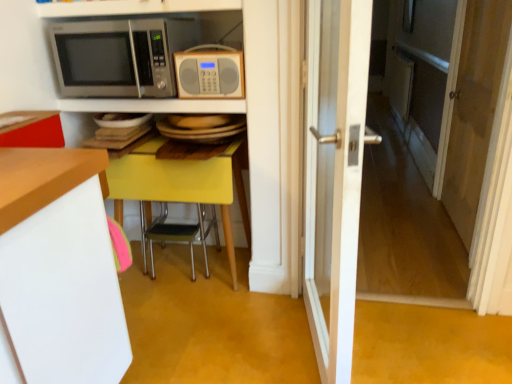
How much space does metallic silver microwave at upper center, positioned as the 1th shelf in bottom-to-top order, occupy vertically?

2.18 inches.

What do you see at coordinates (474, 109) in the screenshot? I see `transparent glass door at right` at bounding box center [474, 109].

Locate an element on the screen. The image size is (512, 384). satin silver microwave at upper left, which ranks as the second microwave oven in right-to-left order is located at coordinates (120, 56).

How much space does white glossy shelf at upper center, acting as the 2th shelf starting from the bottom, occupy vertically?

2.13 inches.

Identify the location of matte gray radio at center, placed as the second microwave oven when sorted from left to right. (210, 72).

Measure the distance between point (223,199) and camera.

Point (223,199) and camera are 1.93 meters apart.

At what (x,y) coordinates should I click in order to perform the action: click on metallic silver microwave at upper center, positioned as the 1th shelf in bottom-to-top order. Please return your answer as a coordinate pair (x, y). Image resolution: width=512 pixels, height=384 pixels. Looking at the image, I should click on (153, 105).

Based on the photo, are transparent glass door at right and matte gray radio at center, marked as the first microwave oven in a right-to-left arrangement, far apart?

transparent glass door at right is far away from matte gray radio at center, marked as the first microwave oven in a right-to-left arrangement.

The height and width of the screenshot is (384, 512). What are the coordinates of `the 1st microwave oven above the transparent glass door at right (from a real-world perspective)` in the screenshot? It's located at (x=210, y=72).

What's the angular difference between transparent glass door at right and matte gray radio at center, placed as the second microwave oven when sorted from left to right,'s facing directions?

The facing directions of transparent glass door at right and matte gray radio at center, placed as the second microwave oven when sorted from left to right, are 92.1 degrees apart.

From a real-world perspective, is transparent glass door at right positioned under matte gray radio at center, marked as the first microwave oven in a right-to-left arrangement, based on gravity?

Yes, from a real-world perspective, transparent glass door at right is under matte gray radio at center, marked as the first microwave oven in a right-to-left arrangement.

Considering the relative positions of satin silver microwave at upper left, which ranks as the second microwave oven in right-to-left order, and matte gray radio at center, placed as the second microwave oven when sorted from left to right, in the image provided, is satin silver microwave at upper left, which ranks as the second microwave oven in right-to-left order, to the left of matte gray radio at center, placed as the second microwave oven when sorted from left to right, from the viewer's perspective?

Correct, you'll find satin silver microwave at upper left, which ranks as the second microwave oven in right-to-left order, to the left of matte gray radio at center, placed as the second microwave oven when sorted from left to right.

Which of these two, satin silver microwave at upper left, the first microwave oven when ordered from left to right, or matte gray radio at center, marked as the first microwave oven in a right-to-left arrangement, stands taller?

satin silver microwave at upper left, the first microwave oven when ordered from left to right, is taller.

Where is `microwave oven that appears behind the satin silver microwave at upper left, which ranks as the second microwave oven in right-to-left order`? The width and height of the screenshot is (512, 384). microwave oven that appears behind the satin silver microwave at upper left, which ranks as the second microwave oven in right-to-left order is located at coordinates (210, 72).

How different are the orientations of satin silver microwave at upper left, which ranks as the second microwave oven in right-to-left order, and matte gray radio at center, marked as the first microwave oven in a right-to-left arrangement, in degrees?

1.87 degrees separate the facing orientations of satin silver microwave at upper left, which ranks as the second microwave oven in right-to-left order, and matte gray radio at center, marked as the first microwave oven in a right-to-left arrangement.

Consider the image. Which object is further away from the camera taking this photo, matte gray radio at center, marked as the first microwave oven in a right-to-left arrangement, or yellow glossy table at center?

yellow glossy table at center is behind.

Looking at the image, does matte gray radio at center, marked as the first microwave oven in a right-to-left arrangement, seem bigger or smaller compared to yellow glossy table at center?

In the image, matte gray radio at center, marked as the first microwave oven in a right-to-left arrangement, appears to be smaller than yellow glossy table at center.

Is matte gray radio at center, marked as the first microwave oven in a right-to-left arrangement, far from yellow glossy table at center?

They are positioned close to each other.

From a real-world perspective, which object stands above the other?

From a 3D spatial view, matte gray radio at center, marked as the first microwave oven in a right-to-left arrangement, is above.

Does matte gray radio at center, placed as the second microwave oven when sorted from left to right, come behind transparent glass door at right?

No, it is in front of transparent glass door at right.

Which point is more distant from viewer, (220, 55) or (458, 132)?

The point (458, 132) is behind.

What are the coordinates of `screen door behind the matte gray radio at center, marked as the first microwave oven in a right-to-left arrangement` in the screenshot? It's located at (474, 109).

Is matte gray radio at center, placed as the second microwave oven when sorted from left to right, oriented away from transparent glass door at right?

That's not correct — matte gray radio at center, placed as the second microwave oven when sorted from left to right, is not looking away from transparent glass door at right.

Is white wooden door at center in front of or behind metallic yellow chair at center in the image?

white wooden door at center is positioned closer to the viewer than metallic yellow chair at center.

Choose the correct answer: Is white wooden door at center inside metallic yellow chair at center or outside it?

The correct answer is: outside.

Consider the image. Considering the relative sizes of white wooden door at center and metallic yellow chair at center in the image provided, is white wooden door at center taller than metallic yellow chair at center?

Indeed, white wooden door at center has a greater height compared to metallic yellow chair at center.

Looking at their sizes, would you say yellow glossy table at center is wider or thinner than metallic silver microwave at upper center, which is the second shelf from top to bottom?

In the image, yellow glossy table at center appears to be wider than metallic silver microwave at upper center, which is the second shelf from top to bottom.

From a real-world perspective, is yellow glossy table at center below metallic silver microwave at upper center, which is the second shelf from top to bottom?

Yes, from a real-world perspective, yellow glossy table at center is beneath metallic silver microwave at upper center, which is the second shelf from top to bottom.

Would you consider yellow glossy table at center to be distant from metallic silver microwave at upper center, which is the second shelf from top to bottom?

No, yellow glossy table at center is not far from metallic silver microwave at upper center, which is the second shelf from top to bottom.

Is metallic silver microwave at upper center, which is the second shelf from top to bottom, far from matte gray radio at center, marked as the first microwave oven in a right-to-left arrangement?

No, metallic silver microwave at upper center, which is the second shelf from top to bottom, is not far away from matte gray radio at center, marked as the first microwave oven in a right-to-left arrangement.

Does metallic silver microwave at upper center, positioned as the 1th shelf in bottom-to-top order, have a lesser height compared to matte gray radio at center, marked as the first microwave oven in a right-to-left arrangement?

Yes.

Is metallic silver microwave at upper center, which is the second shelf from top to bottom, inside or outside of matte gray radio at center, placed as the second microwave oven when sorted from left to right?

The correct answer is: outside.

Starting from the matte gray radio at center, placed as the second microwave oven when sorted from left to right, which shelf is the 2nd one to the left? Please provide its 2D coordinates.

[(153, 105)]

Where is `screen door on the right of matte gray radio at center, placed as the second microwave oven when sorted from left to right`? This screenshot has height=384, width=512. screen door on the right of matte gray radio at center, placed as the second microwave oven when sorted from left to right is located at coordinates (474, 109).

The width and height of the screenshot is (512, 384). Identify the location of microwave oven located behind the satin silver microwave at upper left, the first microwave oven when ordered from left to right. (210, 72).

From the image, which object appears to be nearer to white glossy shelf at upper center, acting as the 2th shelf starting from the bottom, white wooden door at center or yellow glossy table at center?

yellow glossy table at center is closer to white glossy shelf at upper center, acting as the 2th shelf starting from the bottom.

From the picture: Which object lies further to the anchor point transparent glass door at right, white glossy shelf at upper center, which is the 1th shelf in top-to-bottom order, or matte gray radio at center, marked as the first microwave oven in a right-to-left arrangement?

The object further to transparent glass door at right is white glossy shelf at upper center, which is the 1th shelf in top-to-bottom order.

Which object lies further to the anchor point satin silver microwave at upper left, the first microwave oven when ordered from left to right, transparent glass door at right or matte gray radio at center, placed as the second microwave oven when sorted from left to right?

transparent glass door at right lies further to satin silver microwave at upper left, the first microwave oven when ordered from left to right, than the other object.

Looking at the image, which one is located further to matte gray radio at center, marked as the first microwave oven in a right-to-left arrangement, metallic silver microwave at upper center, which is the second shelf from top to bottom, or yellow glossy table at center?

Among the two, yellow glossy table at center is located further to matte gray radio at center, marked as the first microwave oven in a right-to-left arrangement.

Based on their spatial positions, is transparent glass door at right or yellow glossy table at center closer to white wooden door at center?

yellow glossy table at center.

Looking at the image, which one is located closer to yellow glossy table at center, metallic silver microwave at upper center, positioned as the 1th shelf in bottom-to-top order, or satin silver microwave at upper left, which ranks as the second microwave oven in right-to-left order?

metallic silver microwave at upper center, positioned as the 1th shelf in bottom-to-top order, lies closer to yellow glossy table at center than the other object.

Based on their spatial positions, is matte gray radio at center, placed as the second microwave oven when sorted from left to right, or metallic silver microwave at upper center, which is the second shelf from top to bottom, closer to transparent glass door at right?

matte gray radio at center, placed as the second microwave oven when sorted from left to right, is closer to transparent glass door at right.

Estimate the real-world distances between objects in this image. Which object is further from white wooden door at center, white glossy shelf at upper center, which is the 1th shelf in top-to-bottom order, or yellow glossy table at center?

white glossy shelf at upper center, which is the 1th shelf in top-to-bottom order, is positioned further to the anchor white wooden door at center.

Identify the location of shelf between white wooden door at center and metallic silver microwave at upper center, which is the second shelf from top to bottom, along the z-axis. The image size is (512, 384). (132, 7).

Where is `table between satin silver microwave at upper left, the first microwave oven when ordered from left to right, and metallic yellow chair at center from top to bottom`? The height and width of the screenshot is (384, 512). table between satin silver microwave at upper left, the first microwave oven when ordered from left to right, and metallic yellow chair at center from top to bottom is located at coordinates (182, 184).

Locate an element on the screen. microwave oven between metallic yellow chair at center and transparent glass door at right in the horizontal direction is located at coordinates (210, 72).

At what (x,y) coordinates should I click in order to perform the action: click on table between metallic silver microwave at upper center, which is the second shelf from top to bottom, and metallic yellow chair at center from top to bottom. Please return your answer as a coordinate pair (x, y). Looking at the image, I should click on (182, 184).